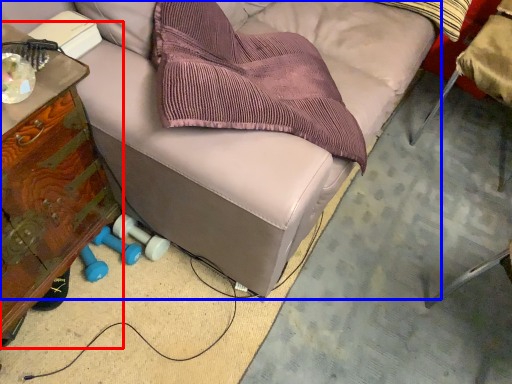
Question: Which of the following is the closest to the observer, furniture (highlighted by a red box) or furniture (highlighted by a blue box)?

Choices:
 (A) furniture
 (B) furniture

Answer: (A)